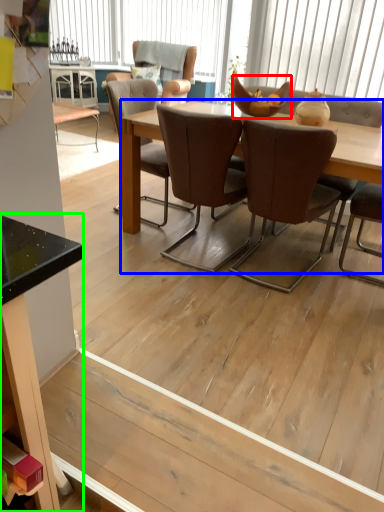
Question: Which object is the farthest from bowl (highlighted by a red box)? Choose among these: kitchen & dining room table (highlighted by a blue box) or desk (highlighted by a green box).

Choices:
 (A) kitchen & dining room table
 (B) desk

Answer: (B)